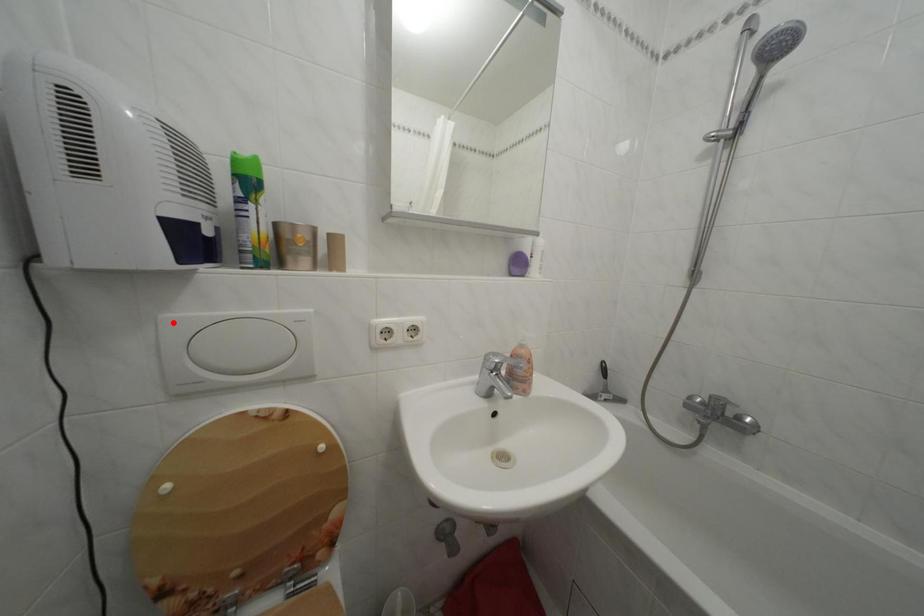
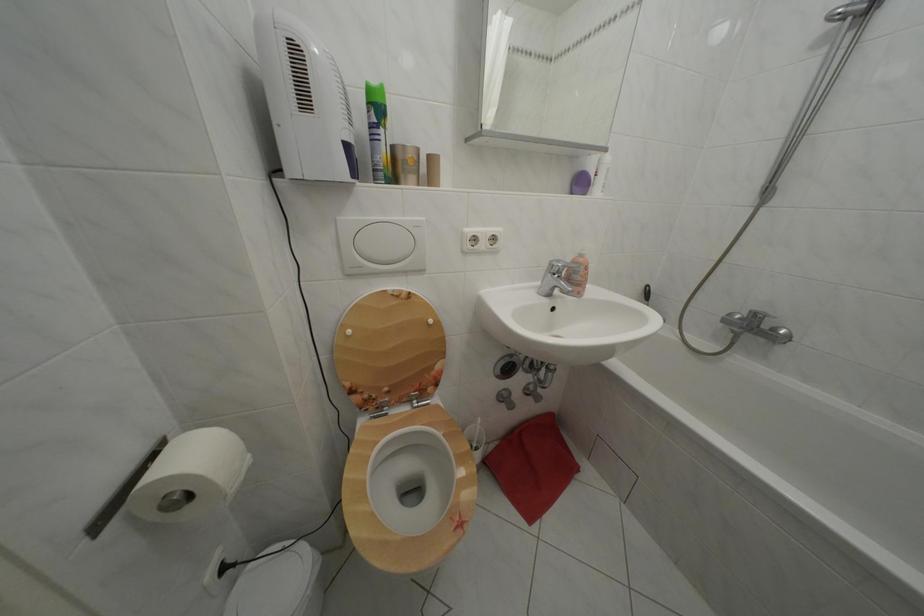
The point at the highlighted location is marked in the first image. Where is the corresponding point in the second image?

(348, 225)